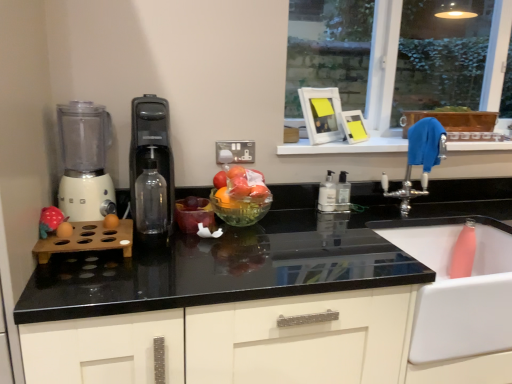
Identify the location of vacant area located to the right-hand side of matte pink plush toy at left. (98, 229).